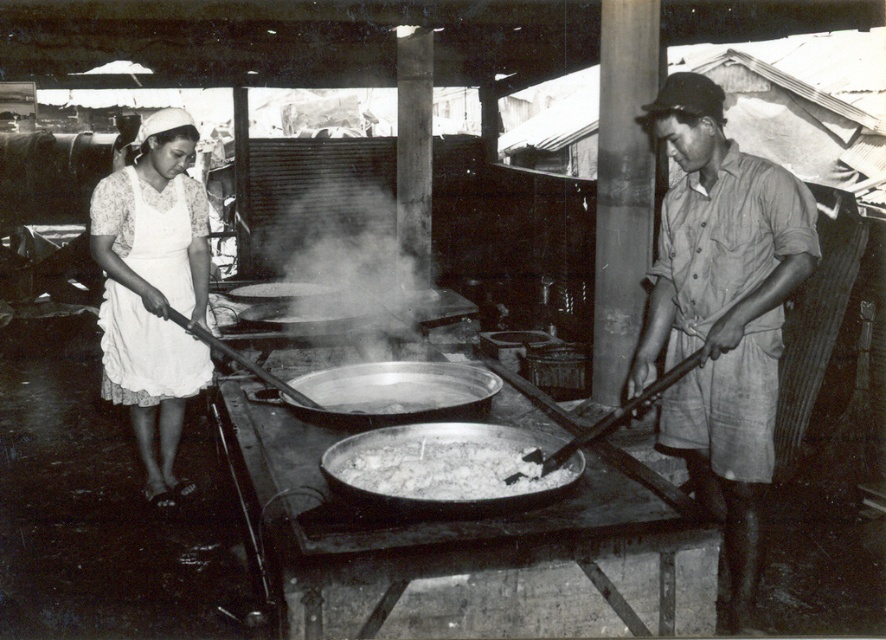
You are a visitor at this outdoor kitchen and want to know where to place your new pot. Considering the white apron at left and the shiny metal wok at center, which object is taller and should you place your pot near the taller one?

The white apron at left is much taller than the shiny metal wok at center, so you should place your pot near the white apron at left.

You are a chef trying to decide which item to move first. Since you want to handle the smaller item first, which one should you choose between the white apron at left and the shiny metal wok at center?

The white apron at left is smaller in width compared to the shiny metal wok at center, so you should move the white apron at left first.